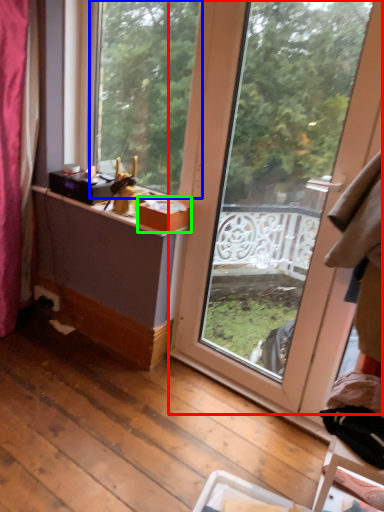
Question: Which is farther away from window (highlighted by a red box)? window (highlighted by a blue box) or box (highlighted by a green box)?

Choices:
 (A) window
 (B) box

Answer: (A)